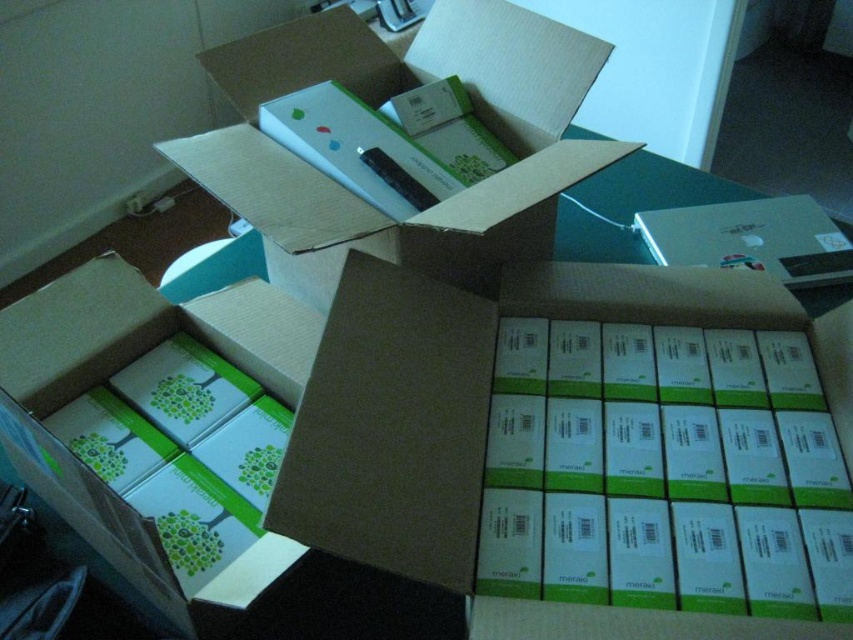
Which of these two, white matte cardboard box at center or white matte box at center, stands shorter?

white matte cardboard box at center is shorter.

Who is taller, white matte cardboard box at center or white matte box at center?

Standing taller between the two is white matte box at center.

Who is more forward, (x=360, y=550) or (x=241, y=321)?

Point (x=360, y=550) is more forward.

The height and width of the screenshot is (640, 853). Find the location of `white matte cardboard box at center`. white matte cardboard box at center is located at coordinates (477, 396).

Does white matte cardboard box at center appear on the right side of white cardboard box at upper center?

Yes, white matte cardboard box at center is to the right of white cardboard box at upper center.

I want to click on white matte cardboard box at center, so click(x=477, y=396).

At what (x,y) coordinates should I click in order to perform the action: click on white matte cardboard box at center. Please return your answer as a coordinate pair (x, y). Looking at the image, I should click on (477, 396).

What are the coordinates of `white cardboard box at upper center` in the screenshot? It's located at (398, 141).

Describe the element at coordinates (398, 141) in the screenshot. I see `white cardboard box at upper center` at that location.

This screenshot has height=640, width=853. What are the coordinates of `white cardboard box at upper center` in the screenshot? It's located at (398, 141).